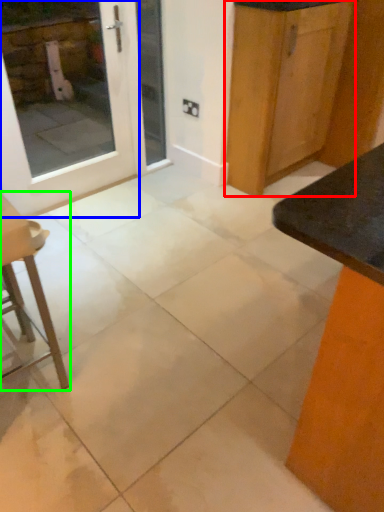
Question: Which object is positioned closest to cabinetry (highlighted by a red box)? Select from door (highlighted by a blue box) and furniture (highlighted by a green box).

Choices:
 (A) door
 (B) furniture

Answer: (A)